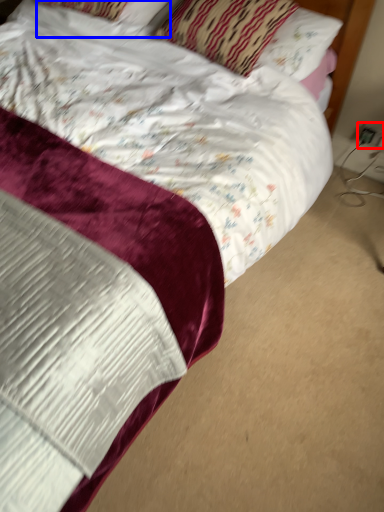
Question: Which of the following is the farthest to the observer, electric outlet (highlighted by a red box) or pillow (highlighted by a blue box)?

Choices:
 (A) electric outlet
 (B) pillow

Answer: (A)